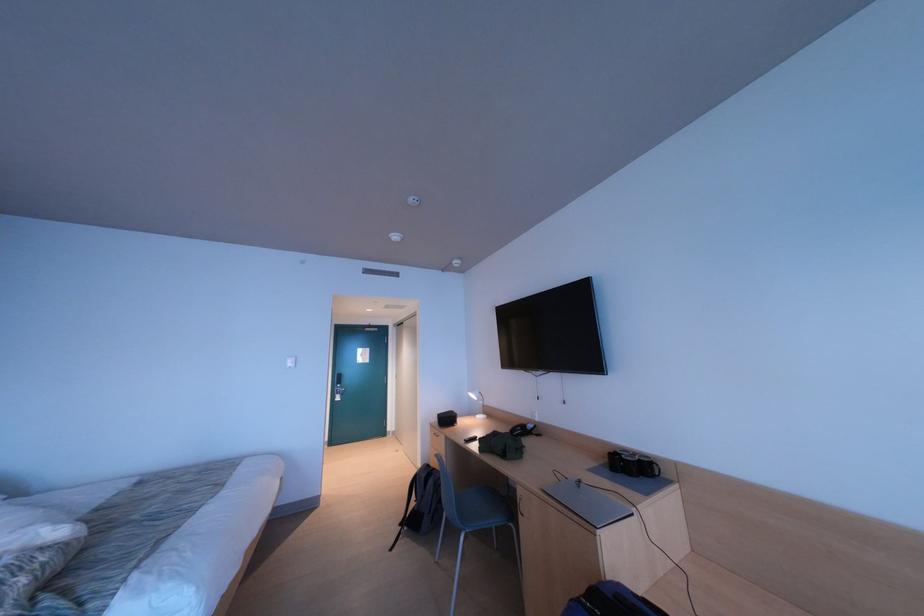
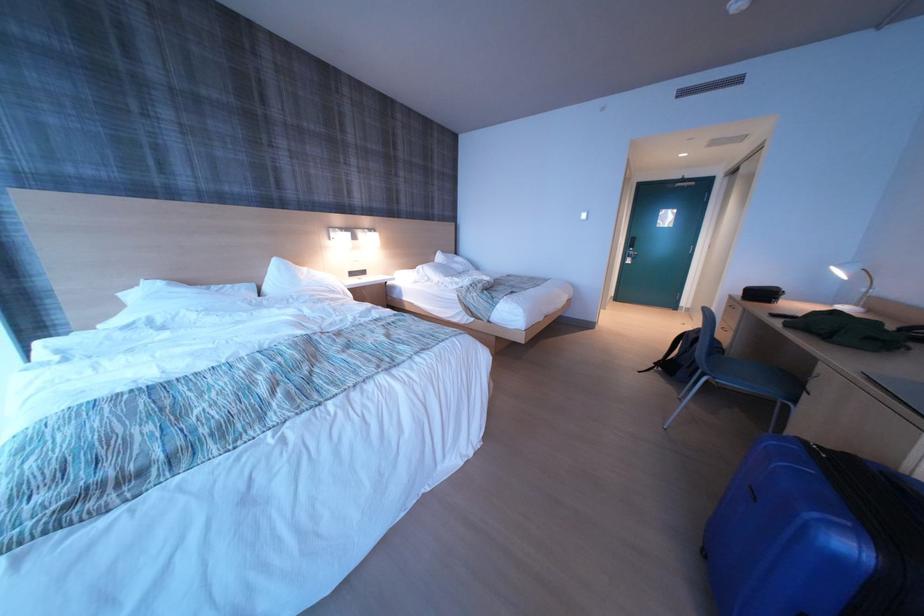
How did the camera likely rotate?

The camera's rotation is toward left-down.